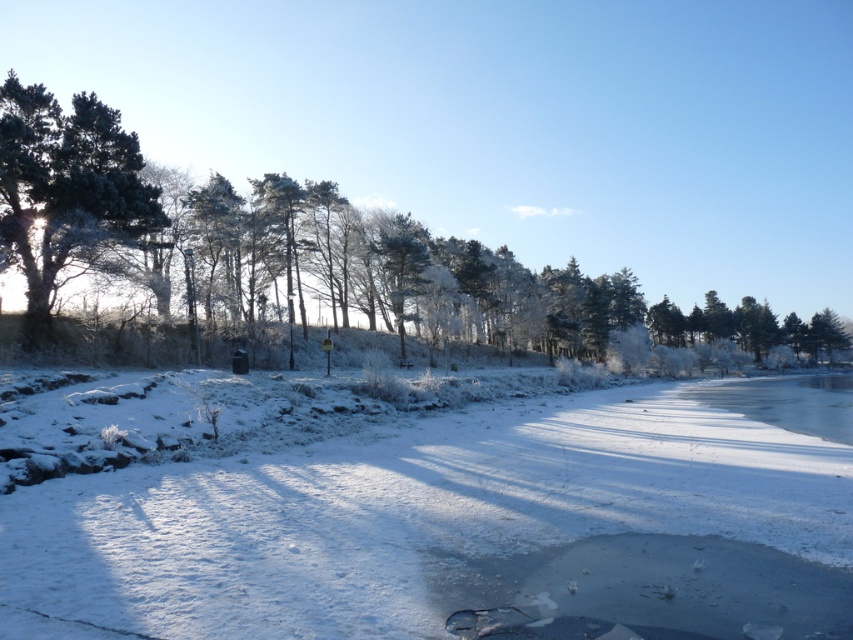
Looking at this image, you are a hiker trying to navigate through the winter landscape. You see the white frosty snow at center and the glossy dark green tree at upper left. Which direction should you head to move towards the tree?

To move towards the glossy dark green tree at upper left, you should head to the left side of the white frosty snow at center since the tree is positioned to the left of the snow.

You are an explorer who just arrived at this winter scene. You see the white frosty snow at center and the green frosted tree at left. Which object is located to the right of the other?

The white frosty snow at center is positioned on the left side of green frosted tree at left, so the green frosted tree at left is to the right of the white frosty snow at center.

You are an observer standing at the edge of the frozen water in the lower right. You see the white frosty snow at center and the green frosted tree at left. Which object is closer to you?

The white frosty snow at center is closer to you because it has a smaller size compared to the green frosted tree at left, indicating it is nearer in the scene.